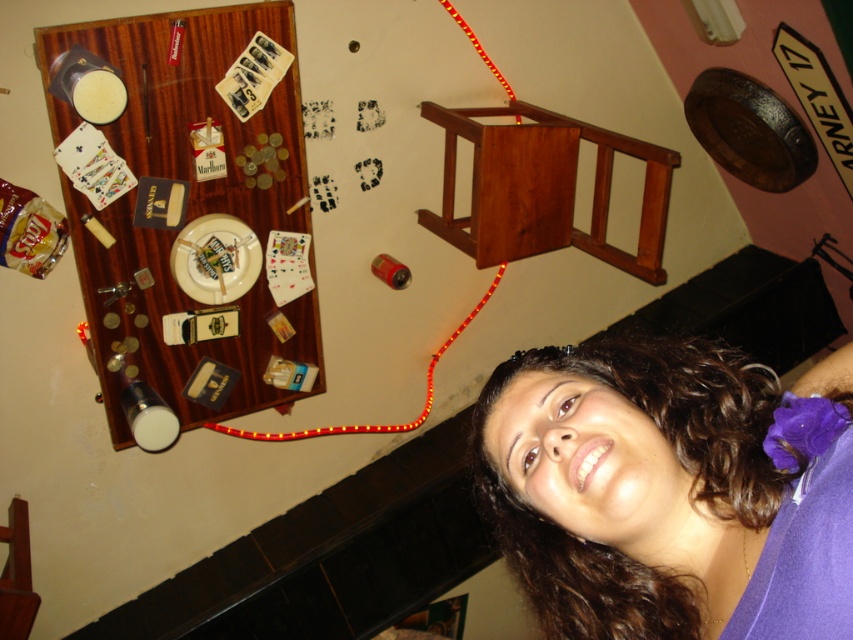
Question: Which point appears farthest from the camera in this image?

Choices:
 (A) (428, 362)
 (B) (616, 484)

Answer: (A)

Question: Is dark brown hair at upper right below red led strip at center?

Choices:
 (A) no
 (B) yes

Answer: (A)

Question: Which point appears farthest from the camera in this image?

Choices:
 (A) (640, 394)
 (B) (421, 413)

Answer: (B)

Question: Is dark brown hair at upper right closer to the viewer compared to red led strip at center?

Choices:
 (A) yes
 (B) no

Answer: (A)

Question: Can you confirm if dark brown hair at upper right is positioned above red led strip at center?

Choices:
 (A) yes
 (B) no

Answer: (A)